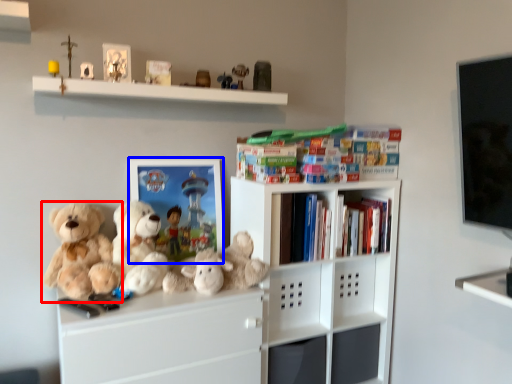
Question: Among these objects, which one is nearest to the camera, teddy bear (highlighted by a red box) or picture frame (highlighted by a blue box)?

Choices:
 (A) teddy bear
 (B) picture frame

Answer: (A)